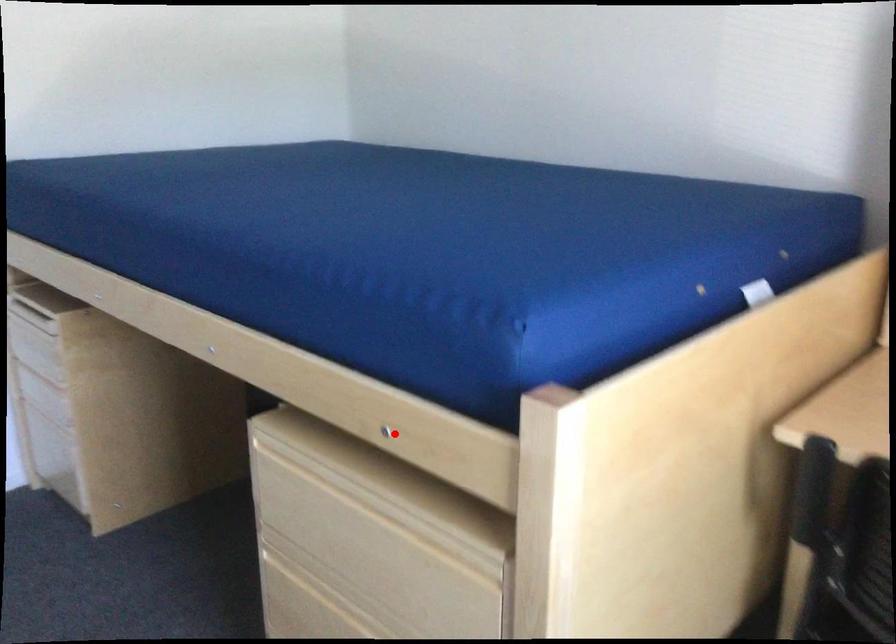
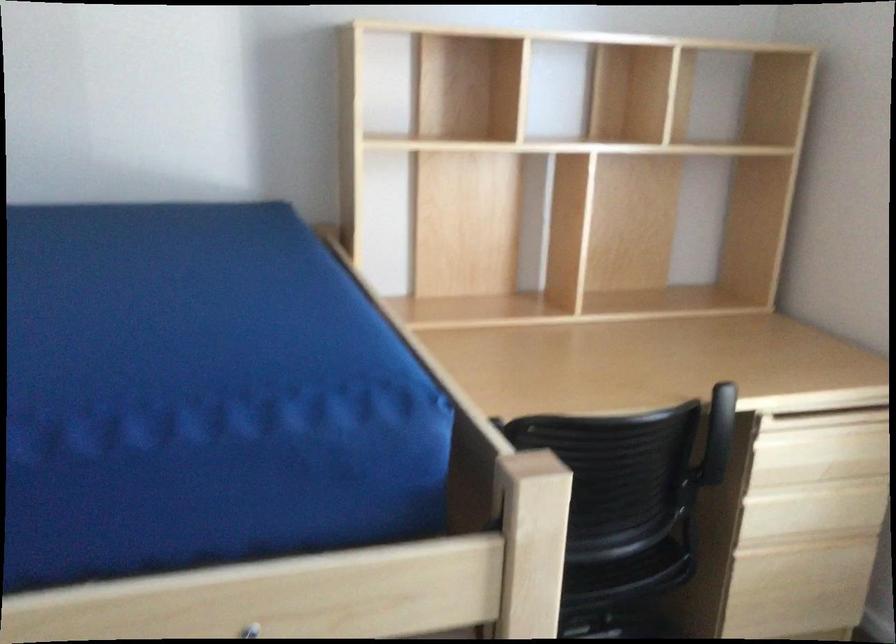
The point at the highlighted location is marked in the first image. Where is the corresponding point in the second image?

(250, 630)